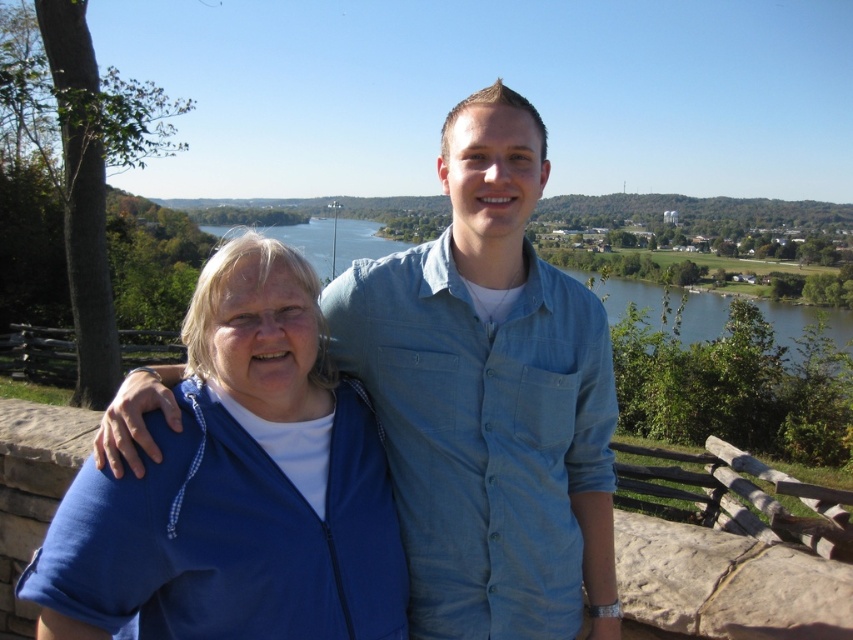
From the picture: Is blue denim shirt at center bigger than blue fleece jacket at left?

Indeed, blue denim shirt at center has a larger size compared to blue fleece jacket at left.

Locate an element on the screen. blue denim shirt at center is located at coordinates (489, 397).